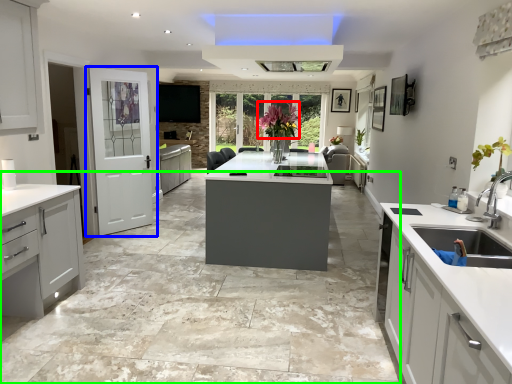
Question: Which object is positioned closest to floral arrangement (highlighted by a red box)? Select from door (highlighted by a blue box) and concrete (highlighted by a green box).

Choices:
 (A) door
 (B) concrete

Answer: (A)